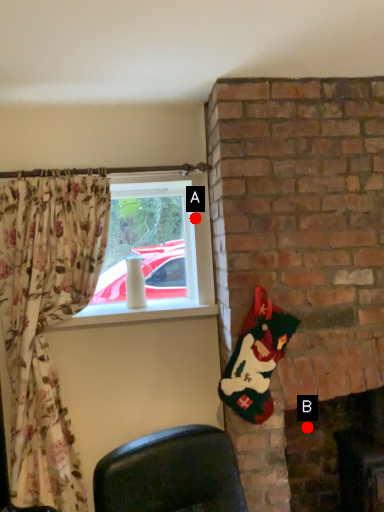
Question: Two points are circled on the image, labeled by A and B beside each circle. Among these points, which one is nearest to the camera?

Choices:
 (A) A is closer
 (B) B is closer

Answer: (A)